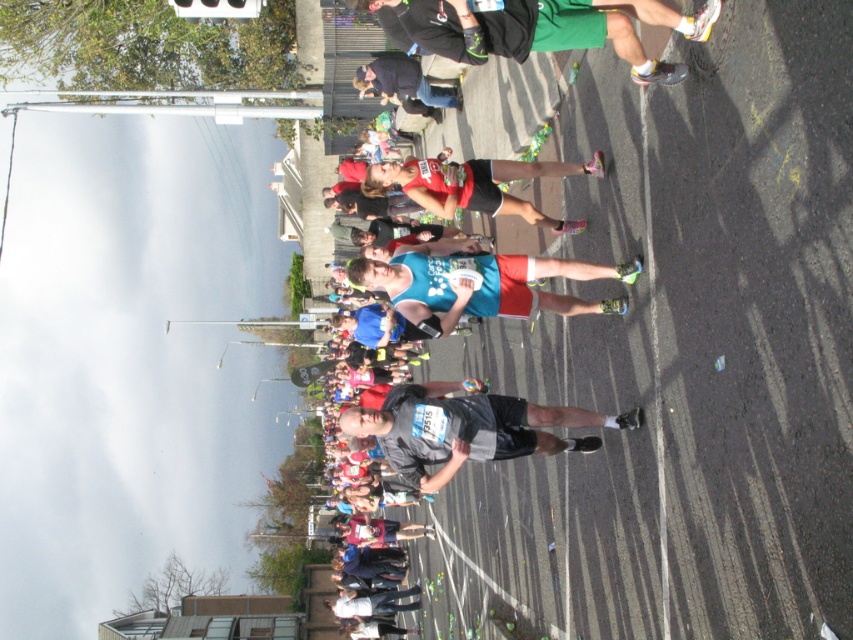
Question: Is dark gray fabric shirt at center positioned behind blue fabric shorts at center?

Choices:
 (A) yes
 (B) no

Answer: (B)

Question: In this image, where is dark gray fabric shirt at center located relative to blue fabric shorts at center?

Choices:
 (A) left
 (B) right

Answer: (A)

Question: Is dark gray fabric shirt at center bigger than blue fabric shorts at center?

Choices:
 (A) no
 (B) yes

Answer: (B)

Question: Which of the following is the farthest from the observer?

Choices:
 (A) blue fabric shorts at center
 (B) dark gray fabric shirt at center

Answer: (A)

Question: Which of the following is the closest to the observer?

Choices:
 (A) dark gray fabric shirt at center
 (B) blue fabric shorts at center

Answer: (A)